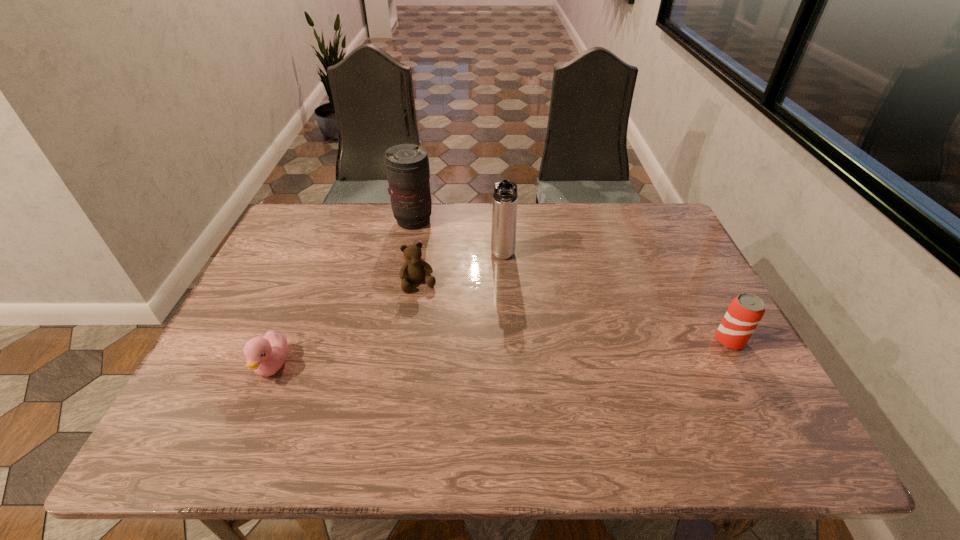
At what (x,y) coordinates should I click in order to perform the action: click on the shortest object. Please return your answer as a coordinate pair (x, y). The image size is (960, 540). Looking at the image, I should click on [x=266, y=355].

You are a GUI agent. You are given a task and a screenshot of the screen. Output one action in this format:
    pyautogui.click(x=<x>, y=<y>)
    Task: Click on the leftmost object
    
    Given the screenshot: What is the action you would take?
    pyautogui.click(x=266, y=355)

The height and width of the screenshot is (540, 960). Identify the location of the rightmost object. (746, 310).

This screenshot has width=960, height=540. I want to click on thermos bottle, so click(504, 212).

Where is `the second object from right to left`? The width and height of the screenshot is (960, 540). the second object from right to left is located at coordinates click(504, 212).

Find the location of `the farthest object`. the farthest object is located at coordinates (407, 165).

Where is `the third nearest object`? The width and height of the screenshot is (960, 540). the third nearest object is located at coordinates (414, 269).

Where is `vacant space located 0.080m on the back of the rightmost object`? vacant space located 0.080m on the back of the rightmost object is located at coordinates click(x=711, y=306).

This screenshot has height=540, width=960. I want to click on vacant space located 0.360m on the handle side of the fourth nearest object, so click(506, 373).

You are a GUI agent. You are given a task and a screenshot of the screen. Output one action in this format:
    pyautogui.click(x=<x>, y=<y>)
    Task: Click on the vacant space situated on the handle side of the fourth nearest object
    
    Given the screenshot: What is the action you would take?
    pyautogui.click(x=505, y=335)